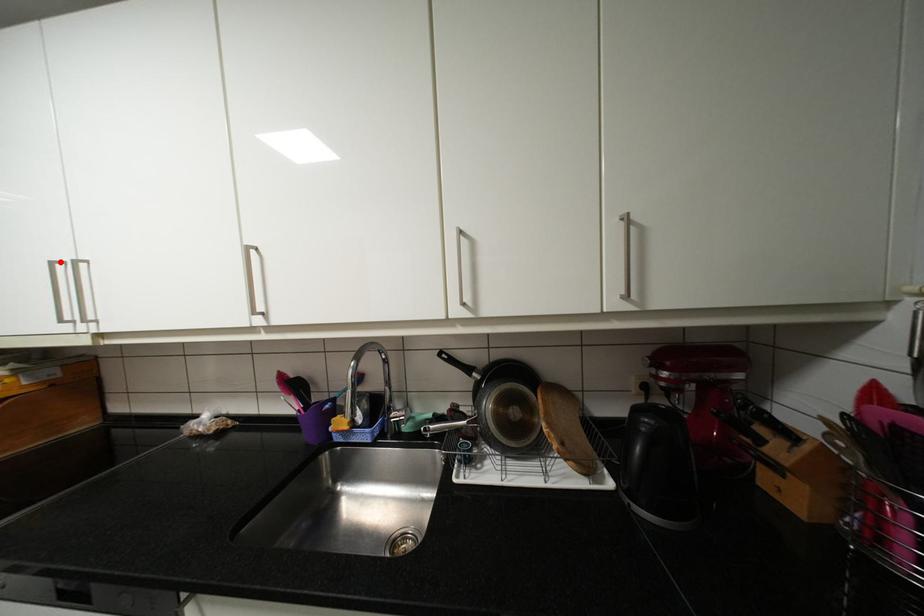
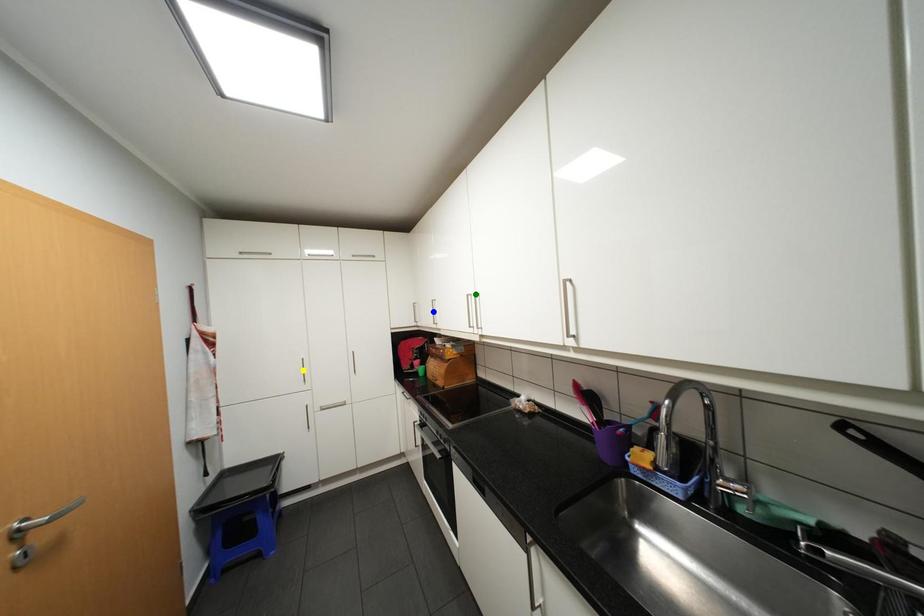
Question: I am providing you with two images of the same scene from different viewpoints. A red point is marked on the first image. You are given multiple points on the second image. Which point in image 2 is actually the same real-world point as the red point in image 1?

Choices:
 (A) green point
 (B) yellow point
 (C) blue point

Answer: (A)